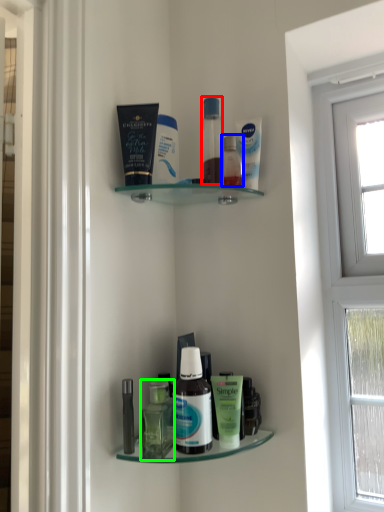
Question: Estimate the real-world distances between objects in this image. Which object is closer to toiletry (highlighted by a red box), toiletry (highlighted by a blue box) or bottle (highlighted by a green box)?

Choices:
 (A) toiletry
 (B) bottle

Answer: (A)